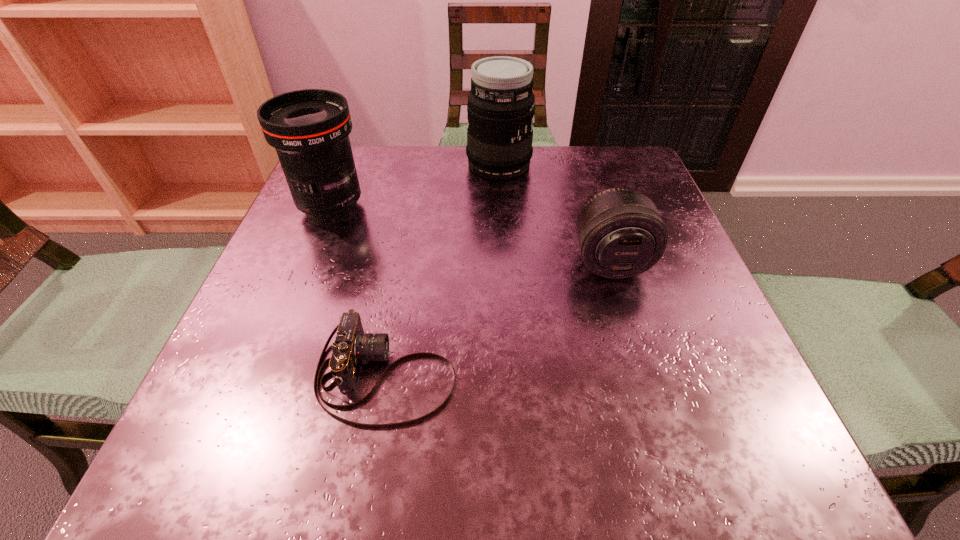
Where is `vacant space that satisfies the following two spatial constraints: 1. on the front side of the third object from left to right; 2. on the front-facing side of the nearest object`? The height and width of the screenshot is (540, 960). vacant space that satisfies the following two spatial constraints: 1. on the front side of the third object from left to right; 2. on the front-facing side of the nearest object is located at coordinates (511, 374).

The image size is (960, 540). Find the location of `vacant region that satisfies the following two spatial constraints: 1. on the back side of the second telephoto lens from right to left; 2. on the left side of the leftmost telephoto lens`. vacant region that satisfies the following two spatial constraints: 1. on the back side of the second telephoto lens from right to left; 2. on the left side of the leftmost telephoto lens is located at coordinates (348, 165).